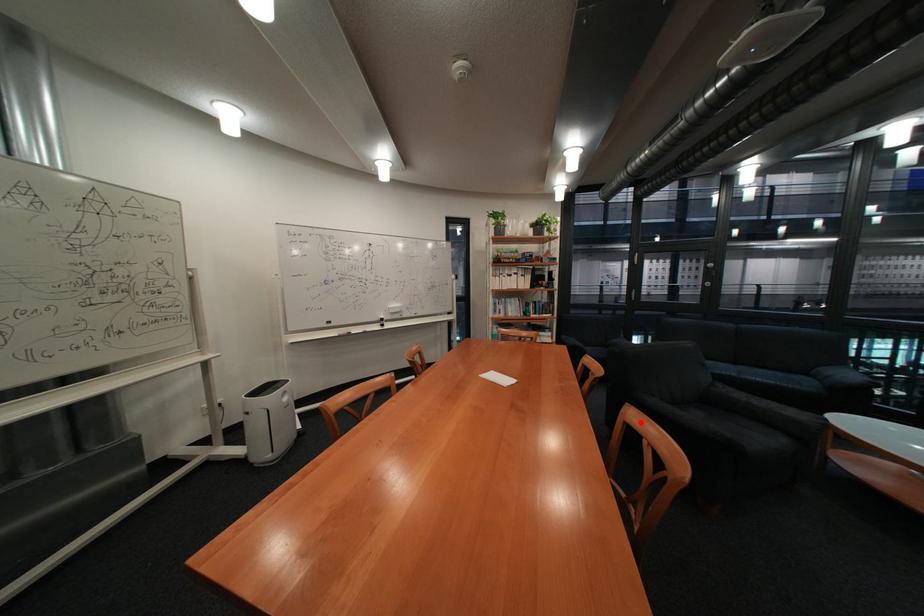
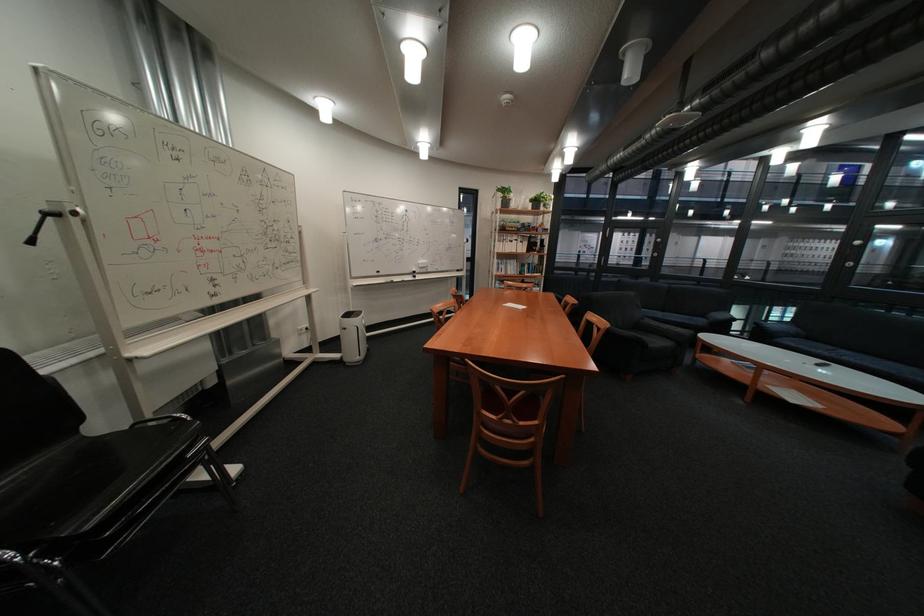
Find the pixel in the second image that matches the highlighted location in the first image.

(602, 320)